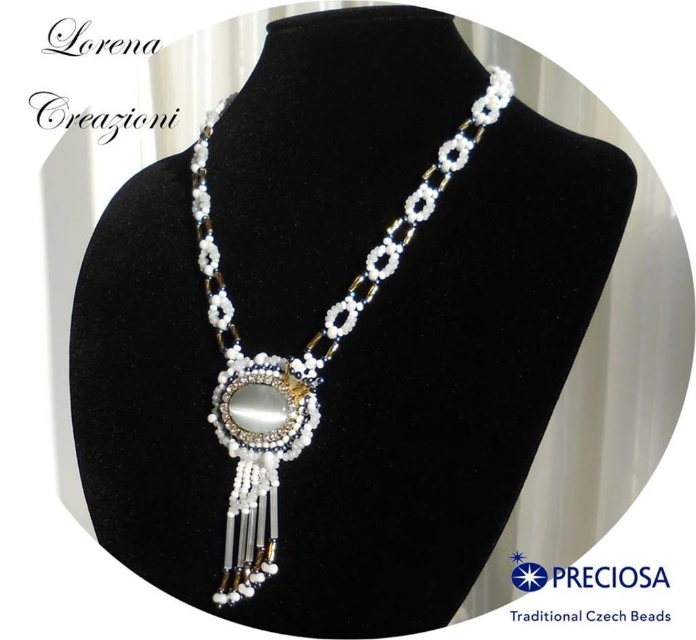
You are a photographer setting up a shot of the white beaded necklace at center. The camera you are using has a focal length of 50mm and an aperture of f2.8. To ensure the necklace is in focus, you need to calculate the hyperfocal distance. What is the hyperfocal distance required to ensure the necklace at 3.62 feet is in focus, assuming a circle of confusion of 0.03 mm for your camera sensor?

The hyperfocal distance can be calculated using the formula HFC formula, but since the necklace is 3.62 feet away, which is very close, you might need to adjust your focus point or use a smaller aperture for better depth of field. However, without precise calculations, it is recommended to focus directly on the necklace to ensure sharpness.

You are an appraiser examining the necklace displayed on the mannequin. You need to determine the spatial relationship between the white beaded necklace at center and the white beaded pendant at center. Which object is positioned to the left?

The white beaded necklace at center is to the left of the white beaded pendant at center.

You are an artisan examining the white beaded necklace at center and the white beaded pendant at center displayed on the mannequin. Which object has a greater width?

The white beaded necklace at center is wider than the white beaded pendant at center according to the description provided.